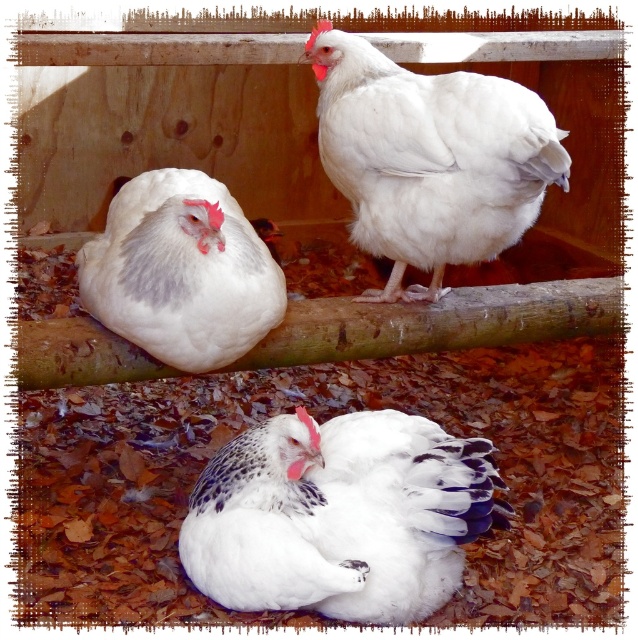
Question: Which of the following is the farthest from the observer?

Choices:
 (A) (315, 58)
 (B) (205, 538)
 (C) (108, 294)

Answer: (A)

Question: Is white fluffy chicken at upper center positioned at the back of white fluffy chicken at upper left?

Choices:
 (A) yes
 (B) no

Answer: (A)

Question: Can you confirm if white fluffy chicken at upper center is wider than white fluffy chicken at upper left?

Choices:
 (A) no
 (B) yes

Answer: (B)

Question: Which point is farther from the camera taking this photo?

Choices:
 (A) (327, 61)
 (B) (255, 518)

Answer: (A)

Question: Does white fluffy chicken at upper center have a smaller size compared to white fluffy chicken at upper left?

Choices:
 (A) no
 (B) yes

Answer: (A)

Question: Based on their relative distances, which object is nearer to the white fluffy chicken at upper left?

Choices:
 (A) white fluffy chicken at upper center
 (B) white feathered chicken at center

Answer: (B)